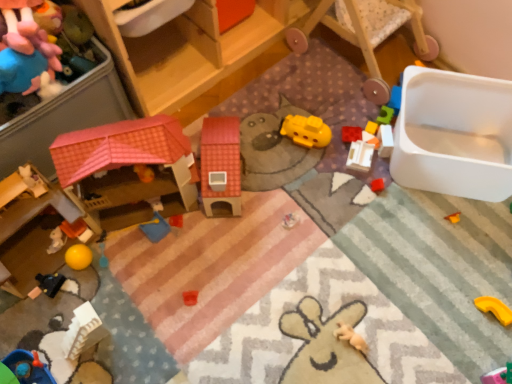
The height and width of the screenshot is (384, 512). In order to click on spots to the right of white plastic building at center-right, the eighth toy when ordered from left to right in this screenshot , I will do `click(423, 148)`.